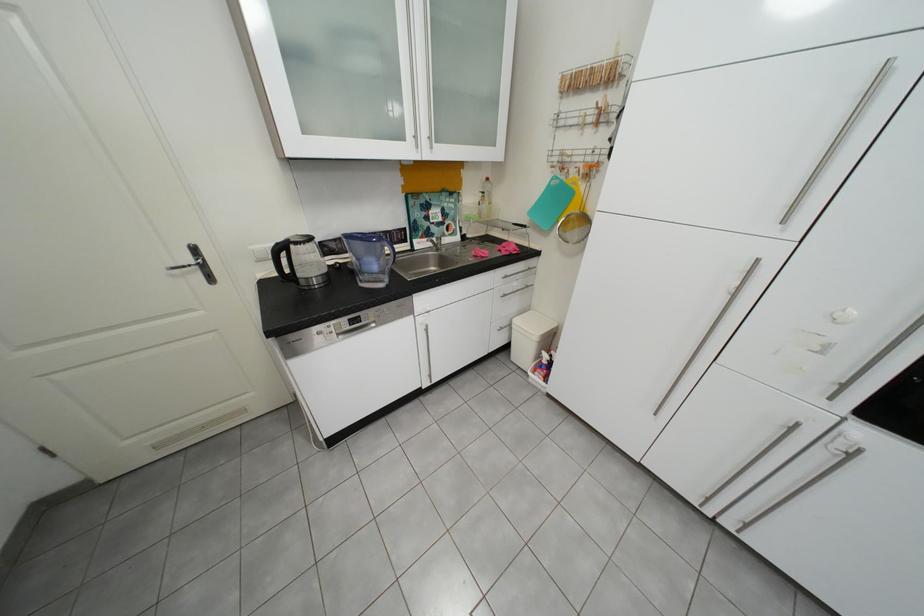
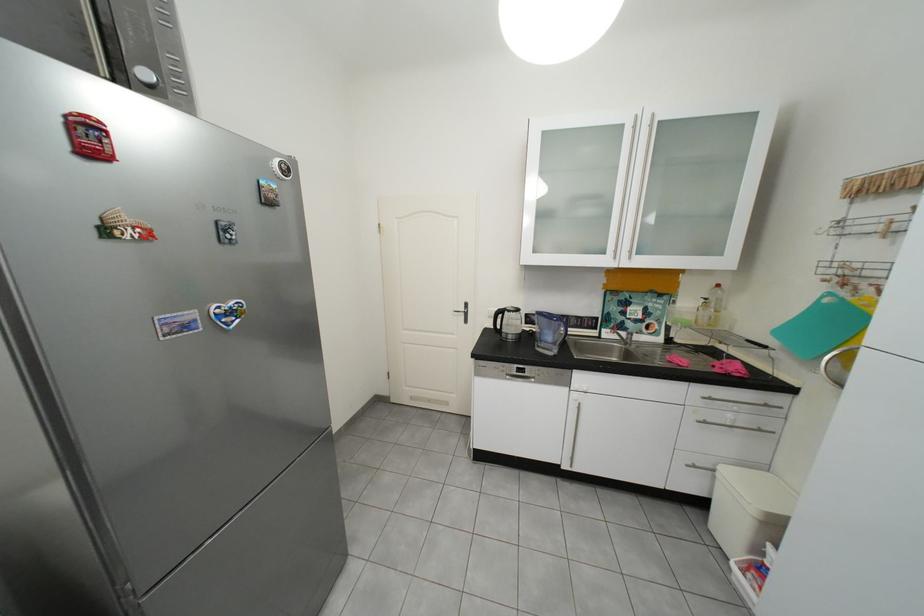
The point at (588, 122) is marked in the first image. Where is the corresponding point in the second image?

(881, 230)